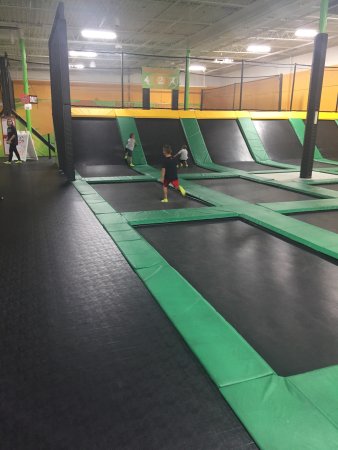
This screenshot has width=338, height=450. I want to click on white easel, so click(x=21, y=146).